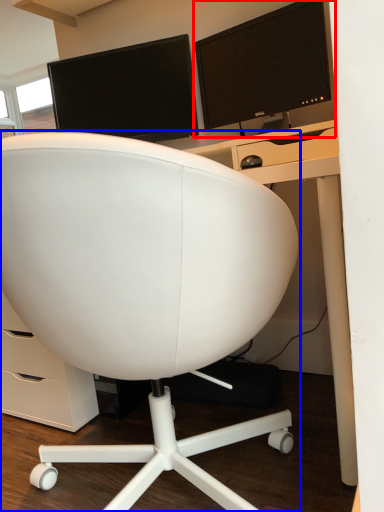
Question: Which object is closer to the camera taking this photo, computer monitor (highlighted by a red box) or chair (highlighted by a blue box)?

Choices:
 (A) computer monitor
 (B) chair

Answer: (B)